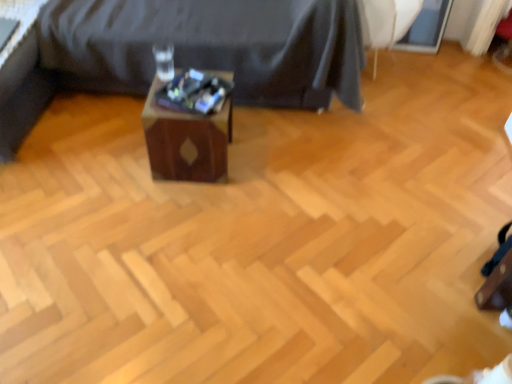
Where is `wooden side table at center`? The height and width of the screenshot is (384, 512). wooden side table at center is located at coordinates (210, 46).

Does wooden box at center lie behind white fabric swivel chair at upper right?

No, it is not.

Is there a large distance between wooden box at center and white fabric swivel chair at upper right?

Yes, wooden box at center is far from white fabric swivel chair at upper right.

There is a wooden box at center. Where is `swivel chair above it (from a real-world perspective)`? swivel chair above it (from a real-world perspective) is located at coordinates (386, 22).

How different are the orientations of wooden box at center and white fabric swivel chair at upper right in degrees?

They differ by 3.08 degrees in their facing directions.

Do you think wooden side table at center is within white fabric swivel chair at upper right, or outside of it?

wooden side table at center exists outside the volume of white fabric swivel chair at upper right.

Who is bigger, wooden side table at center or white fabric swivel chair at upper right?

wooden side table at center is bigger.

Does wooden side table at center have a lesser width compared to white fabric swivel chair at upper right?

In fact, wooden side table at center might be wider than white fabric swivel chair at upper right.

Is white fabric swivel chair at upper right taller than wooden side table at center?

No.

Consider the image. Considering the sizes of objects white fabric swivel chair at upper right and wooden side table at center in the image provided, who is wider, white fabric swivel chair at upper right or wooden side table at center?

Wider between the two is wooden side table at center.

In the scene shown: From the image's perspective, is white fabric swivel chair at upper right over wooden side table at center?

No, from the image's perspective, white fabric swivel chair at upper right is not on top of wooden side table at center.

Which is nearer, (367, 18) or (83, 30)?

The point (83, 30) is in front.

From the image's perspective, between white fabric swivel chair at upper right and wooden box at center, who is located below?

wooden box at center, from the image's perspective.

Who is smaller, white fabric swivel chair at upper right or wooden box at center?

Smaller between the two is wooden box at center.

Is point (362, 11) closer to camera compared to point (170, 165)?

No.

Is wooden box at center next to wooden side table at center and touching it?

No, wooden box at center is not with wooden side table at center.

Does wooden box at center turn towards wooden side table at center?

No, wooden box at center is not facing towards wooden side table at center.

Identify the location of furniture positioned vertically above the wooden box at center (from a real-world perspective). (210, 46).

Considering the points (85, 46) and (148, 108), which point is in front, point (85, 46) or point (148, 108)?

The point (148, 108) is more forward.

Who is more distant, wooden side table at center or wooden box at center?

wooden side table at center is further from the camera.

From the picture: Is wooden side table at center bigger than wooden box at center?

Yes, wooden side table at center is bigger than wooden box at center.

Locate an element on the screen. The image size is (512, 384). table directly beneath the white fabric swivel chair at upper right (from a real-world perspective) is located at coordinates (186, 141).

Where is `swivel chair on the right of the wooden side table at center`? swivel chair on the right of the wooden side table at center is located at coordinates (386, 22).

When comparing their distances from wooden box at center, does wooden side table at center or white fabric swivel chair at upper right seem closer?

The object closer to wooden box at center is wooden side table at center.

Estimate the real-world distances between objects in this image. Which object is further from wooden side table at center, wooden box at center or white fabric swivel chair at upper right?

The object further to wooden side table at center is white fabric swivel chair at upper right.

Which object lies nearer to the anchor point white fabric swivel chair at upper right, wooden side table at center or wooden box at center?

Among the two, wooden side table at center is located nearer to white fabric swivel chair at upper right.

Considering their positions, is white fabric swivel chair at upper right positioned further to wooden box at center than wooden side table at center?

Among the two, white fabric swivel chair at upper right is located further to wooden box at center.

When comparing their distances from white fabric swivel chair at upper right, does wooden box at center or wooden side table at center seem further?

Among the two, wooden box at center is located further to white fabric swivel chair at upper right.

Estimate the real-world distances between objects in this image. Which object is closer to wooden side table at center, white fabric swivel chair at upper right or wooden box at center?

Based on the image, wooden box at center appears to be nearer to wooden side table at center.

This screenshot has height=384, width=512. I want to click on furniture between wooden box at center and white fabric swivel chair at upper right in the horizontal direction, so tap(210, 46).